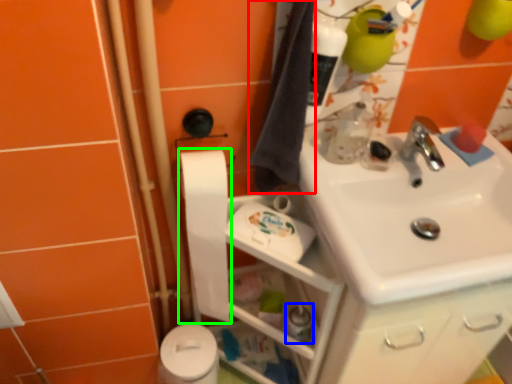
Question: Based on their relative distances, which object is farther from bath towel (highlighted by a red box)? Choose from toiletry (highlighted by a blue box) and toilet paper (highlighted by a green box).

Choices:
 (A) toiletry
 (B) toilet paper

Answer: (A)